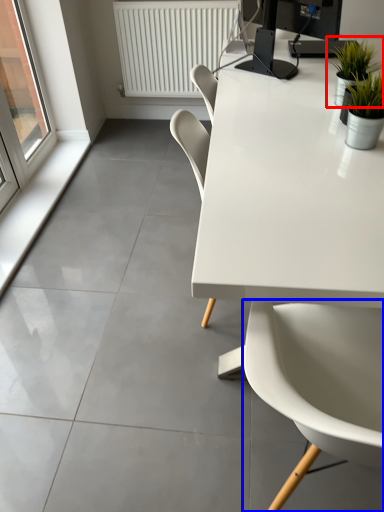
Question: Which object is closer to the camera taking this photo, houseplant (highlighted by a red box) or chair (highlighted by a blue box)?

Choices:
 (A) houseplant
 (B) chair

Answer: (B)